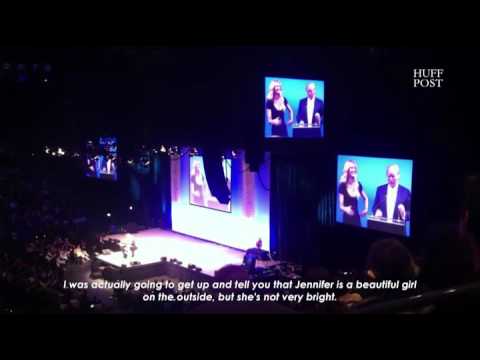
Identify the location of light. The width and height of the screenshot is (480, 360). (61, 151).